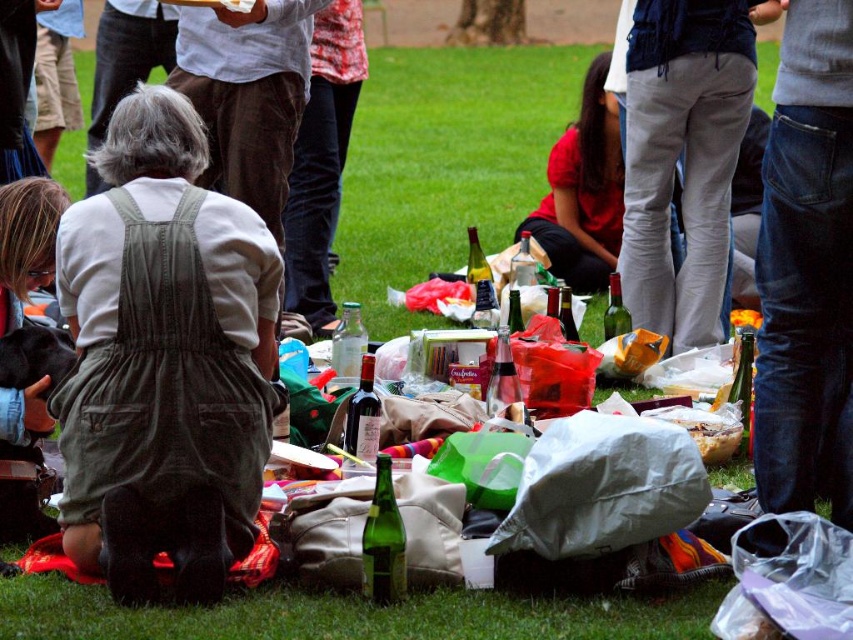
Question: Can you confirm if green corduroy overalls at center is smaller than gray sweatpants at center?

Choices:
 (A) no
 (B) yes

Answer: (B)

Question: Does green corduroy overalls at center come in front of gray sweatpants at center?

Choices:
 (A) no
 (B) yes

Answer: (B)

Question: Among these objects, which one is farthest from the camera?

Choices:
 (A) gray sweatpants at center
 (B) green corduroy overalls at center

Answer: (A)

Question: Is green corduroy overalls at center positioned at the back of gray sweatpants at center?

Choices:
 (A) no
 (B) yes

Answer: (A)